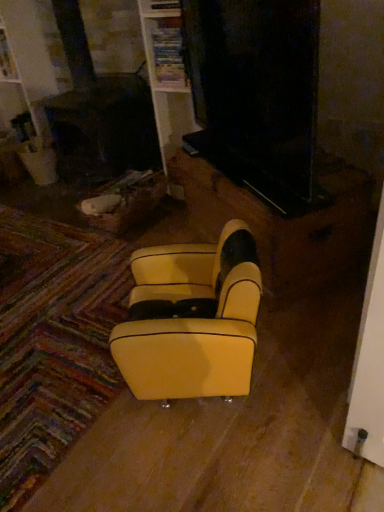
Question: Does yellow leather/velvet rocking chair at center appear on the right side of yellow leather armchair at center?

Choices:
 (A) yes
 (B) no

Answer: (B)

Question: Is yellow leather/velvet rocking chair at center at the left side of yellow leather armchair at center?

Choices:
 (A) yes
 (B) no

Answer: (A)

Question: Can you confirm if yellow leather/velvet rocking chair at center is thinner than yellow leather armchair at center?

Choices:
 (A) yes
 (B) no

Answer: (A)

Question: Can you confirm if yellow leather/velvet rocking chair at center is shorter than yellow leather armchair at center?

Choices:
 (A) no
 (B) yes

Answer: (A)

Question: Is yellow leather/velvet rocking chair at center facing towards yellow leather armchair at center?

Choices:
 (A) yes
 (B) no

Answer: (B)

Question: Is yellow leather/velvet rocking chair at center in contact with yellow leather armchair at center?

Choices:
 (A) yes
 (B) no

Answer: (B)

Question: From a real-world perspective, is yellow leather armchair at center positioned under yellow leather/velvet rocking chair at center based on gravity?

Choices:
 (A) no
 (B) yes

Answer: (B)

Question: Is yellow leather armchair at center with yellow leather/velvet rocking chair at center?

Choices:
 (A) no
 (B) yes

Answer: (A)

Question: Is yellow leather armchair at center positioned beyond the bounds of yellow leather/velvet rocking chair at center?

Choices:
 (A) yes
 (B) no

Answer: (A)

Question: Is yellow leather armchair at center smaller than yellow leather/velvet rocking chair at center?

Choices:
 (A) no
 (B) yes

Answer: (A)

Question: Does yellow leather armchair at center have a greater height compared to yellow leather/velvet rocking chair at center?

Choices:
 (A) no
 (B) yes

Answer: (A)

Question: Is there a large distance between yellow leather armchair at center and yellow leather/velvet rocking chair at center?

Choices:
 (A) no
 (B) yes

Answer: (A)

Question: Considering the positions of point (235, 256) and point (201, 195), is point (235, 256) closer or farther from the camera than point (201, 195)?

Choices:
 (A) closer
 (B) farther

Answer: (A)